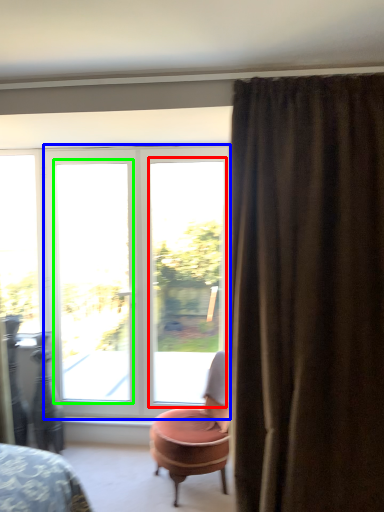
Question: Estimate the real-world distances between objects in this image. Which object is closer to window (highlighted by a red box), door (highlighted by a blue box) or window (highlighted by a green box)?

Choices:
 (A) door
 (B) window

Answer: (A)